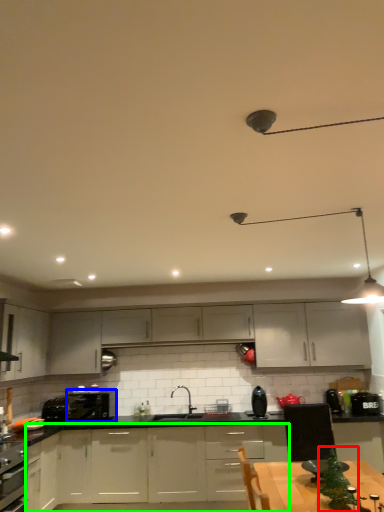
Question: Considering the real-world distances, which object is closest to christmas tree (highlighted by a red box)? kitchen appliance (highlighted by a blue box) or cabinetry (highlighted by a green box).

Choices:
 (A) kitchen appliance
 (B) cabinetry

Answer: (B)